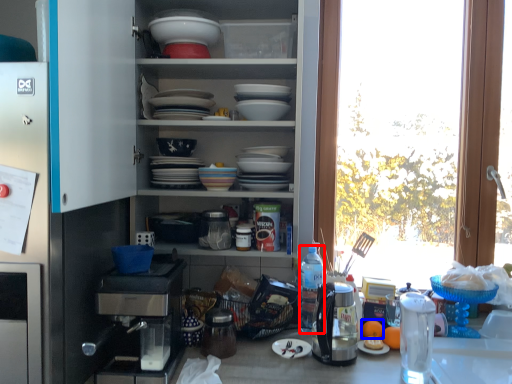
Question: Among these objects, which one is farthest to the camera, bottle (highlighted by a red box) or orange juice (highlighted by a blue box)?

Choices:
 (A) bottle
 (B) orange juice

Answer: (A)